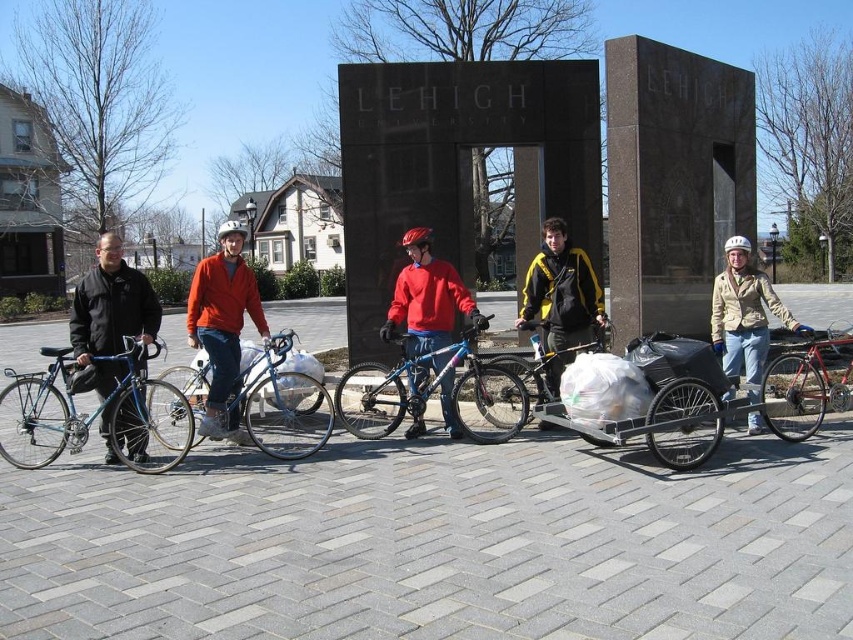
You are a photographer standing in front of the Lehigh University archway. You want to take a photo of the shiny blue bicycle at left and the shiny red bicycle at right. Based on their positions, which bicycle should you focus on first if you want to capture both in a single frame without moving your camera?

The shiny blue bicycle at left is located below the shiny red bicycle at right, so you should focus on the shiny blue bicycle at left first to ensure both are in the frame without moving the camera.